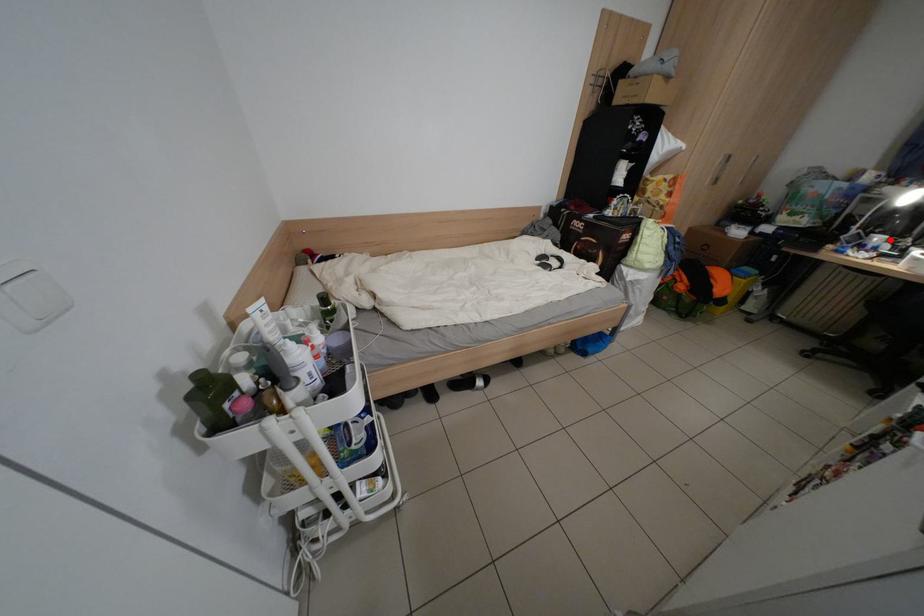
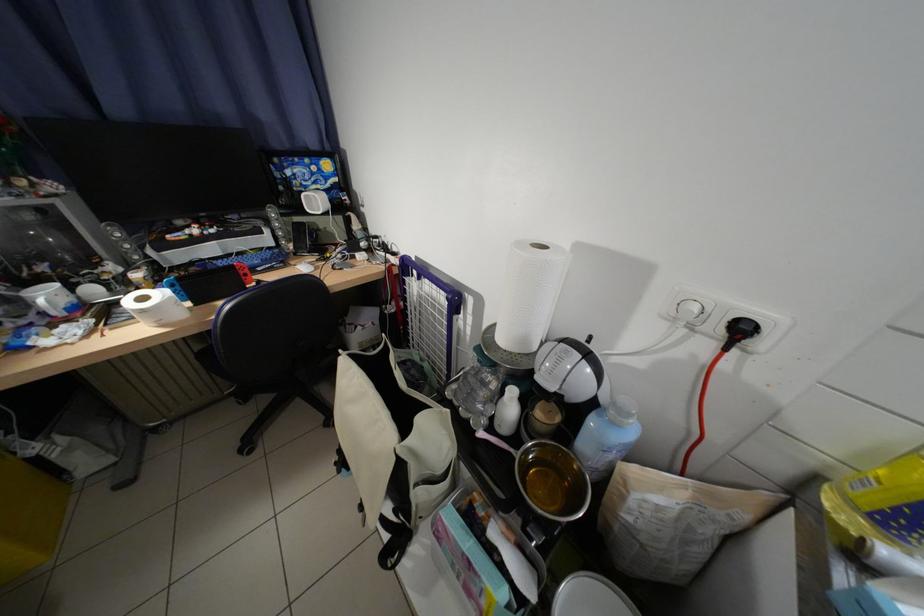
Find the pixel in the second image that matches the highlighted location in the first image.

(59, 297)